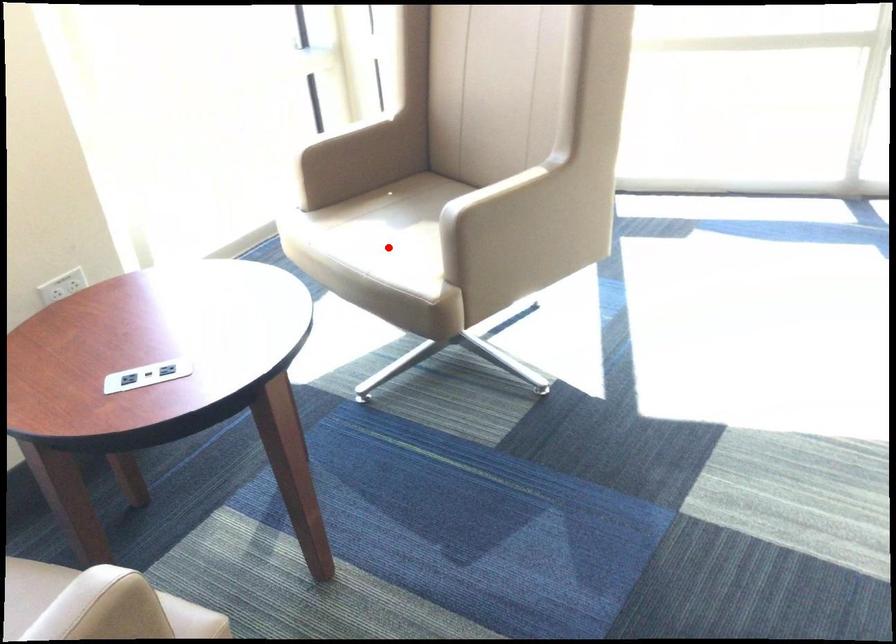
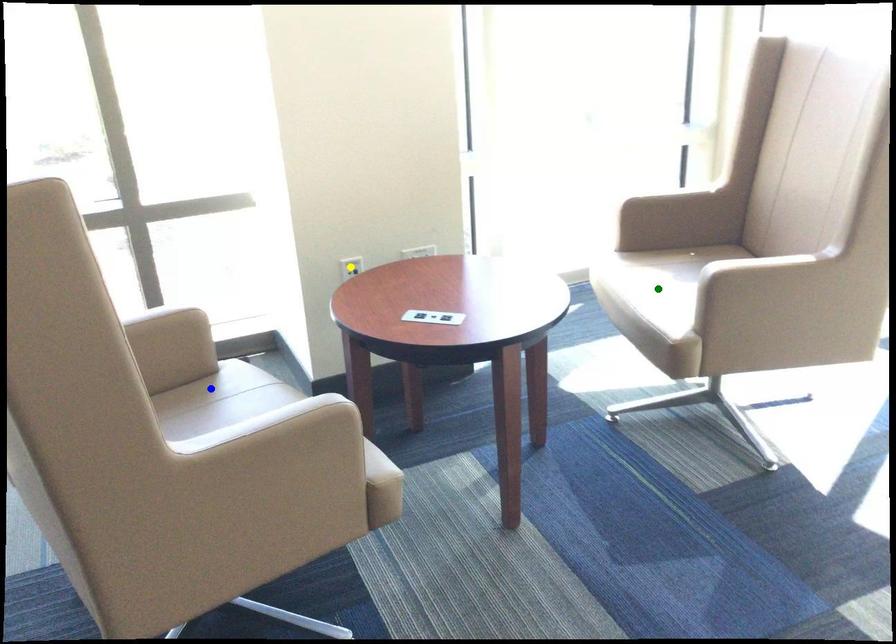
Question: I am providing you with two images of the same scene from different viewpoints. A red point is marked on the first image. You are given multiple points on the second image. Which point in image 2 represents the same 3d spot as the red point in image 1?

Choices:
 (A) yellow point
 (B) green point
 (C) blue point

Answer: (B)